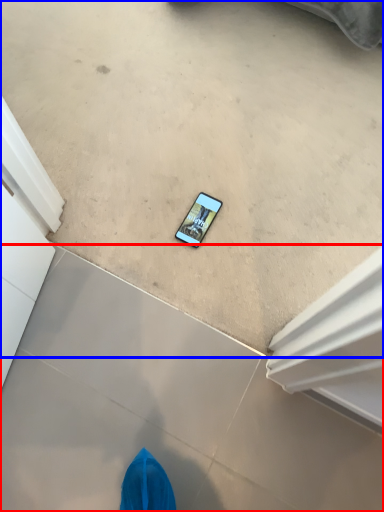
Question: Which of the following is the closest to the observer, concrete (highlighted by a red box) or concrete (highlighted by a blue box)?

Choices:
 (A) concrete
 (B) concrete

Answer: (A)